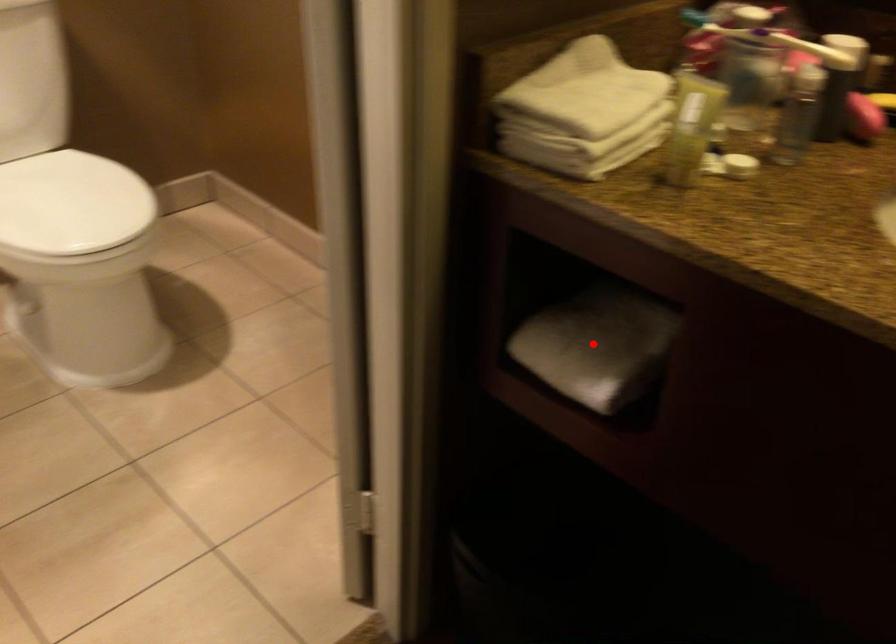
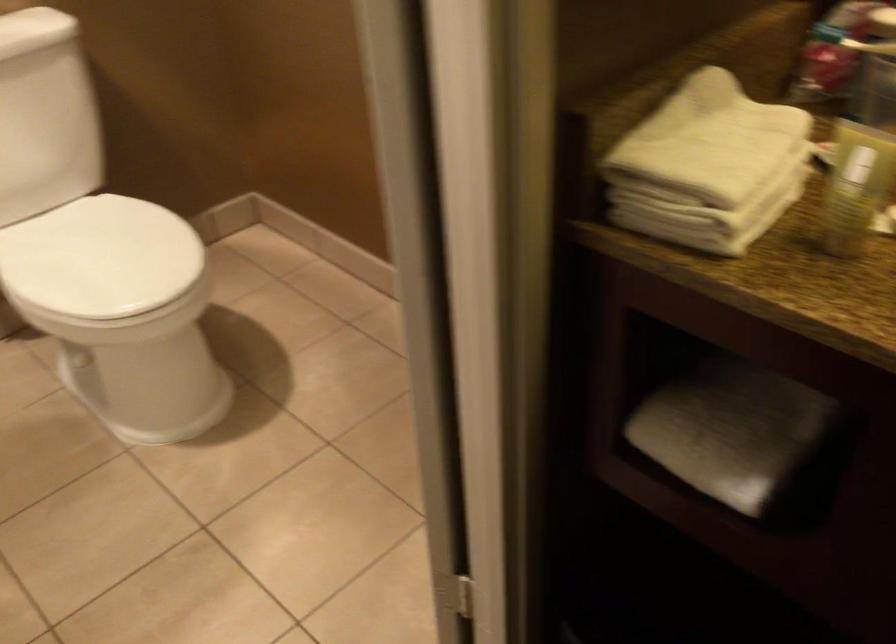
Question: A red point is marked in image1. In image2, is the corresponding 3D point closer to the camera or farther? Reply with the corresponding letter.

Choices:
 (A) The corresponding 3D point is closer.
 (B) The corresponding 3D point is farther.

Answer: (A)